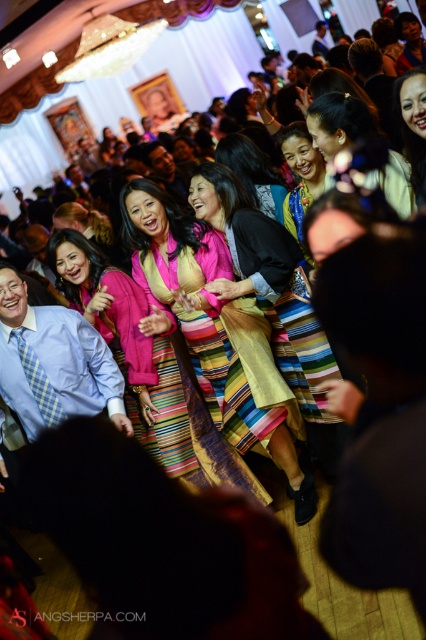
Can you confirm if multicolored woven skirt at center is shorter than matte yellow dress at center?

Incorrect, multicolored woven skirt at center's height does not fall short of matte yellow dress at center's.

Does multicolored woven skirt at center appear under matte yellow dress at center?

Yes.

This screenshot has height=640, width=426. Identify the location of multicolored woven skirt at center. (255, 317).

Can you confirm if matte pink fabric dress at center is positioned to the left of matte yellow dress at center?

Yes, matte pink fabric dress at center is to the left of matte yellow dress at center.

Does point (111, 300) come behind point (417, 164)?

Yes.

You are a GUI agent. You are given a task and a screenshot of the screen. Output one action in this format:
    pyautogui.click(x=<x>, y=<y>)
    Task: Click on the matte pink fabric dress at center
    
    Given the screenshot: What is the action you would take?
    pyautogui.click(x=129, y=348)

Does silky pink dress at center appear over matte yellow dress at center?

No.

What do you see at coordinates (337, 122) in the screenshot?
I see `silky pink dress at center` at bounding box center [337, 122].

The image size is (426, 640). What do you see at coordinates (337, 122) in the screenshot?
I see `silky pink dress at center` at bounding box center [337, 122].

At what (x,y) coordinates should I click in order to perform the action: click on silky pink dress at center. Please return your answer as a coordinate pair (x, y). Looking at the image, I should click on [337, 122].